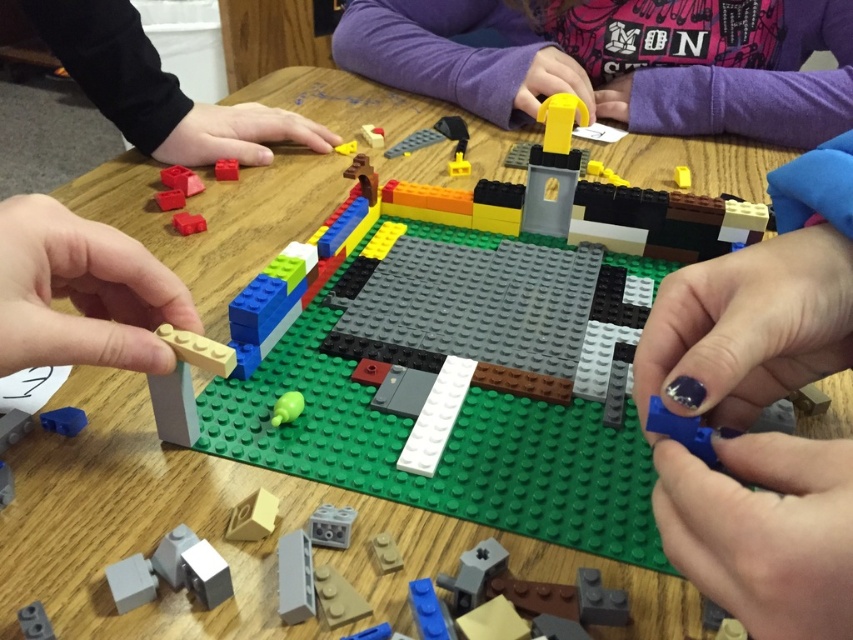
Where is `matte black hand at upper left`? This screenshot has height=640, width=853. matte black hand at upper left is located at coordinates (158, 90).

Who is positioned more to the right, matte black hand at upper left or matte yellow plastic toy at center?

matte yellow plastic toy at center is more to the right.

Identify the location of matte black hand at upper left. (158, 90).

Can you confirm if blue plastic brick at center is bigger than matte gray brick at lower left?

Yes, blue plastic brick at center is bigger than matte gray brick at lower left.

Between point (677, 429) and point (28, 621), which one is positioned behind?

The point (677, 429) is behind.

In order to click on blue plastic brick at center in this screenshot , I will do `click(682, 432)`.

Which of these two, matte gray bricks at lower left or green matte toy at center, stands taller?

With more height is matte gray bricks at lower left.

How distant is matte gray bricks at lower left from green matte toy at center?

matte gray bricks at lower left and green matte toy at center are 4.52 inches apart.

The width and height of the screenshot is (853, 640). I want to click on matte gray bricks at lower left, so click(x=171, y=572).